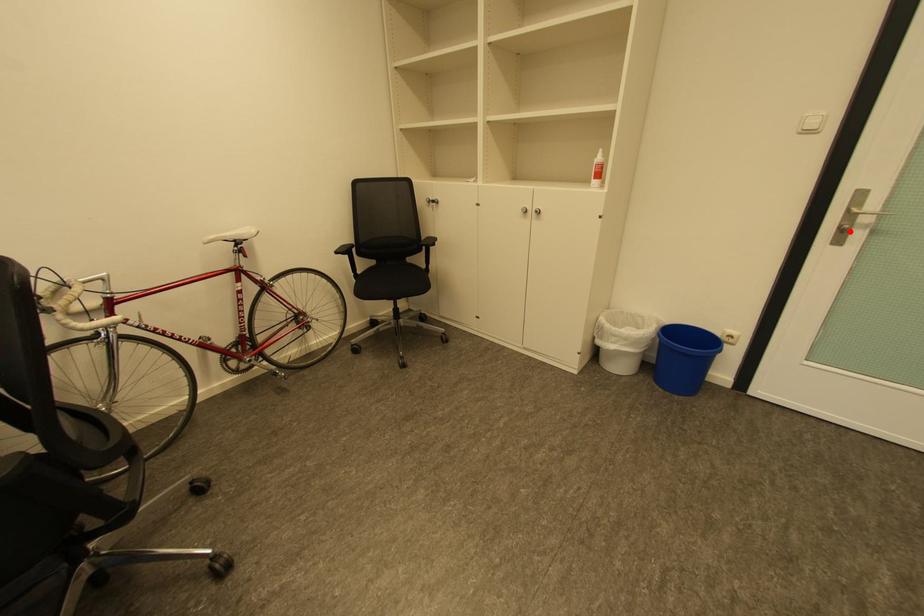
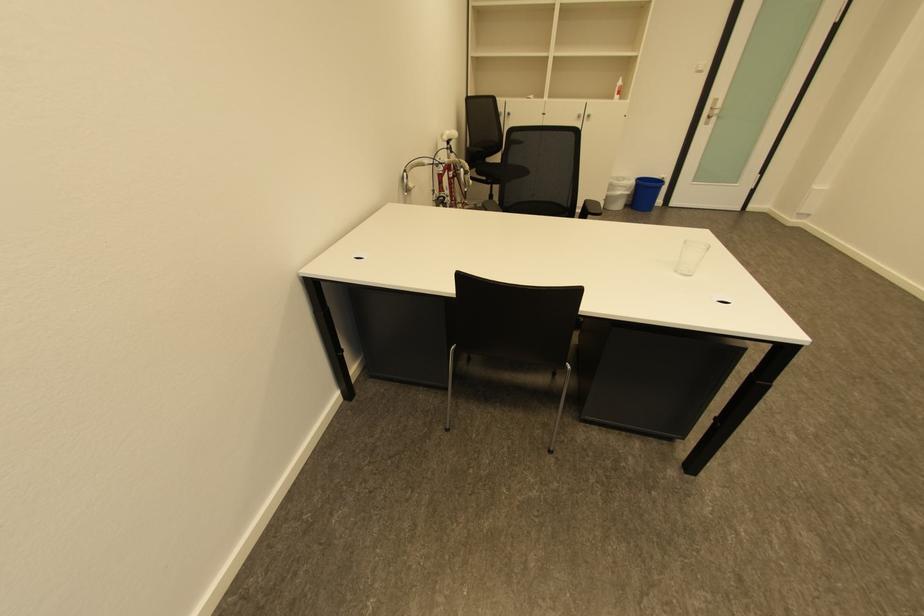
Locate, in the second image, the point that corresponds to the highlighted location in the first image.

(715, 119)